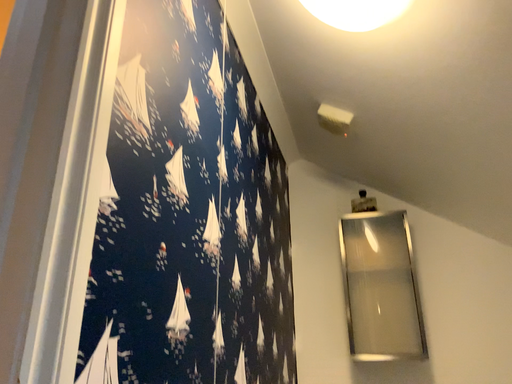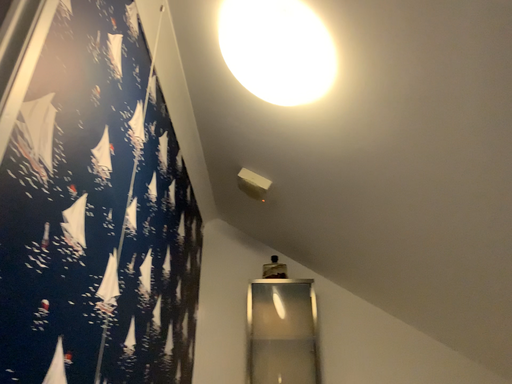
Question: Which way did the camera rotate in the video?

Choices:
 (A) rotated downward
 (B) rotated upward

Answer: (B)